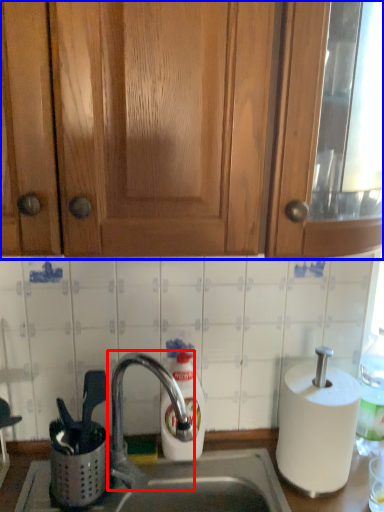
Question: Among these objects, which one is farthest to the camera, tap (highlighted by a red box) or cabinetry (highlighted by a blue box)?

Choices:
 (A) tap
 (B) cabinetry

Answer: (A)